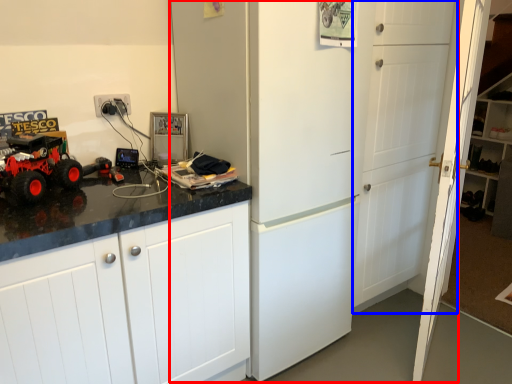
Question: Which of the following is the closest to the observer, refrigerator (highlighted by a red box) or door (highlighted by a blue box)?

Choices:
 (A) refrigerator
 (B) door

Answer: (A)